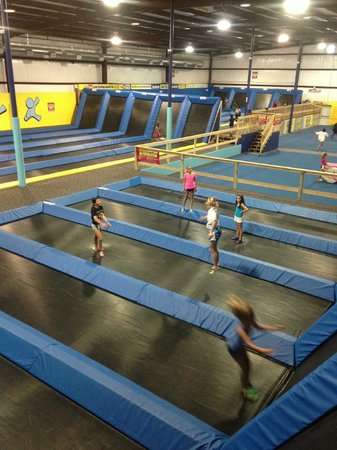
This screenshot has width=337, height=450. What are the coordinates of `support beam` in the screenshot? It's located at 14,97, 170,71, 249,74, 297,79.